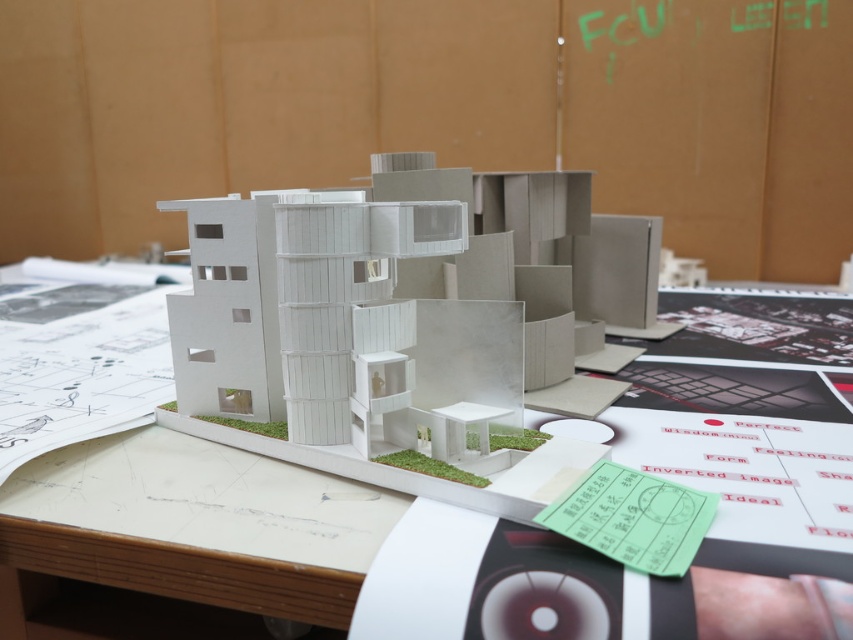
You are an architect examining the architectural model on the desk. You notice two points marked on the desk surface. The first point is at coordinate point [625,272] and the second is at point [122,628]. If you were to draw a straight line between these two points, which point would be closer to the architectural model?

Point [625,272] is behind point [122,628], so the point closer to the architectural model would be point [122,628].

In the scene shown: You are an architect working on a model. You need to place a small figurine exactly at the center of the white cardboard building at center. What are the coordinates where you should place it?

The coordinates for the center of the white cardboard building at center are point (404,307).

You are an architect trying to place a new model on your desk. You have a white cardboard building at center and a white paper at center in front of you. Which object takes up more space on the desk?

The white cardboard building at center is bigger than the white paper at center, so it takes up more space on the desk.